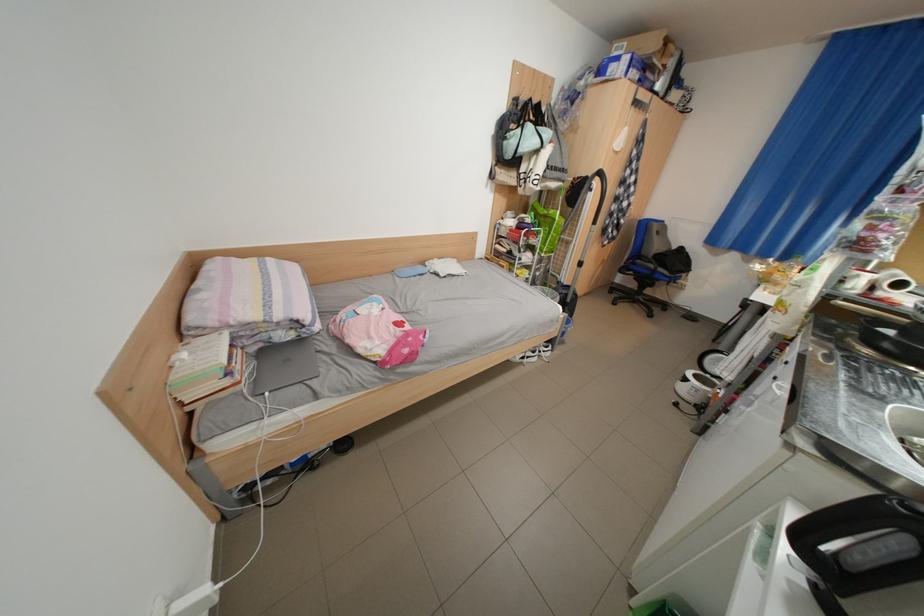
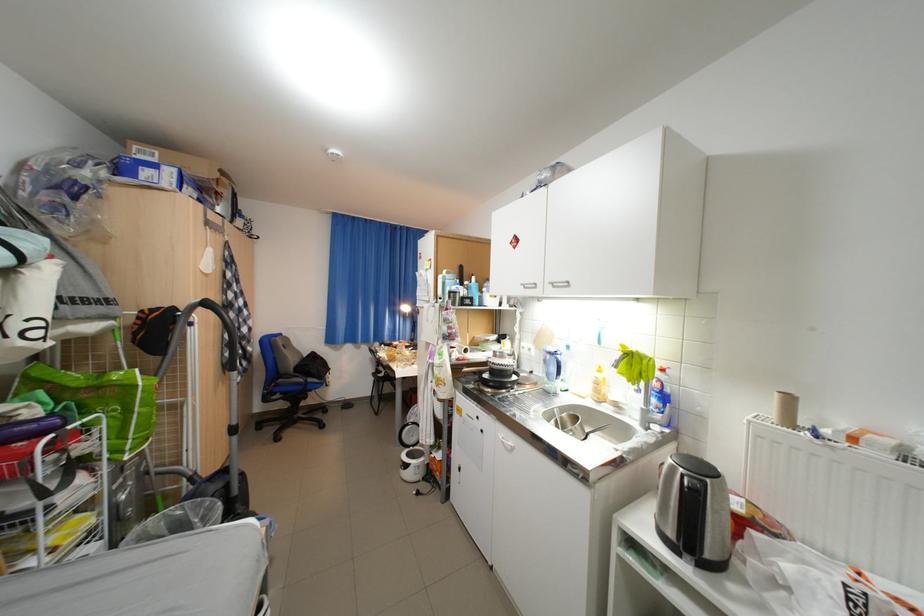
Where in the second image is the point corresponding to [612,175] from the first image?

(217, 305)